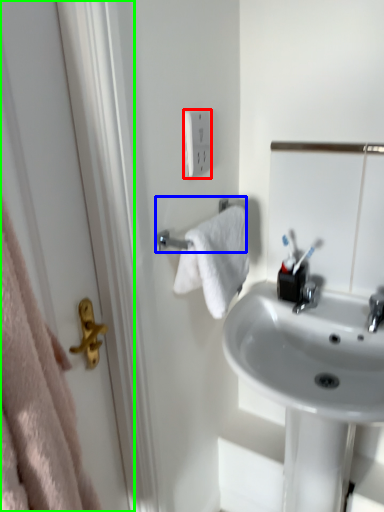
Question: Considering the real-world distances, which object is farthest from electric outlet (highlighted by a red box)? towel rack (highlighted by a blue box) or screen door (highlighted by a green box)?

Choices:
 (A) towel rack
 (B) screen door

Answer: (B)